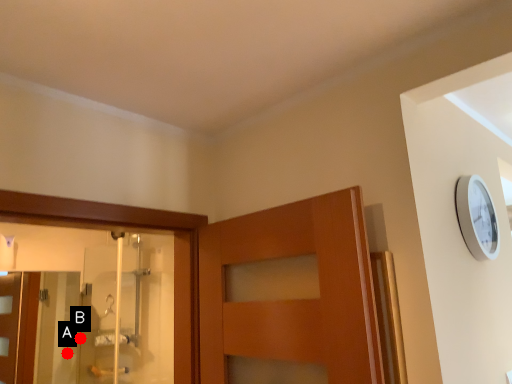
Question: Two points are circled on the image, labeled by A and B beside each circle. Which point is closer to the camera?

Choices:
 (A) A is closer
 (B) B is closer

Answer: (B)